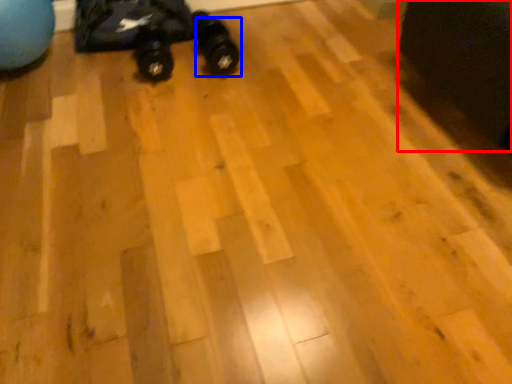
Question: Which of the following is the farthest to the observer, swivel chair (highlighted by a red box) or footwear (highlighted by a blue box)?

Choices:
 (A) swivel chair
 (B) footwear

Answer: (B)